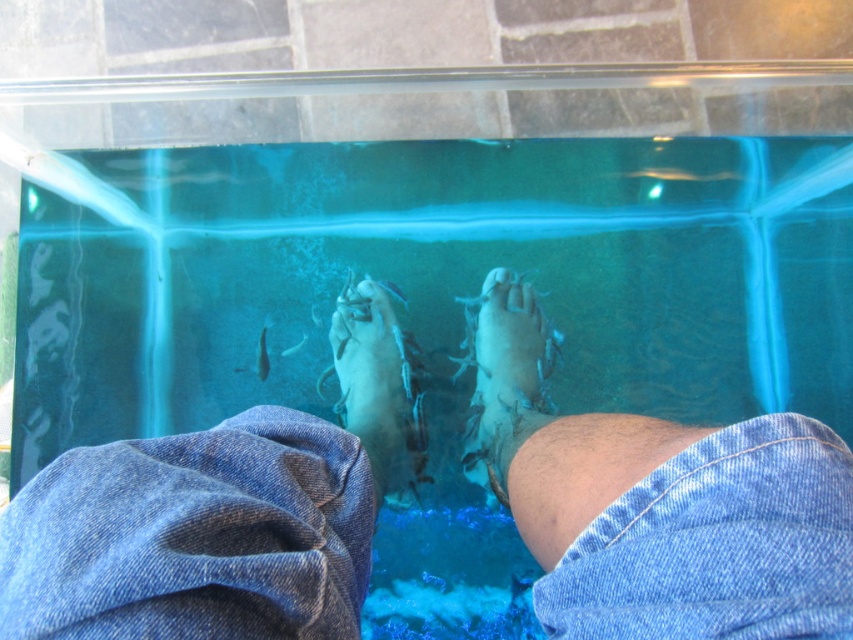
You are a person who wants to take a photo of the white matte fish spa at center without the white matte foot at center blocking the view. Is it possible to take such a photo from your current position?

The white matte foot at center is further to the viewer than the white matte fish spa at center, so the foot is closer to you. Therefore, it will block the view of the fish spa, making it impossible to take a photo without the foot blocking it.

You are a customer at a fish spa and see your denim at lower center and white matte foot at center in the water tank. Which object takes up more space in the tank?

The denim at lower center is larger in size than the white matte foot at center, so it takes up more space in the tank.

You are a lifeguard at a water park and need to ensure safety. You see the denim at lower center and the white matte foot at center in the water tank. Which object is submerged deeper in the water?

The denim at lower center is submerged deeper in the water than the white matte foot at center because the denim at lower center is located below the white matte foot at center.